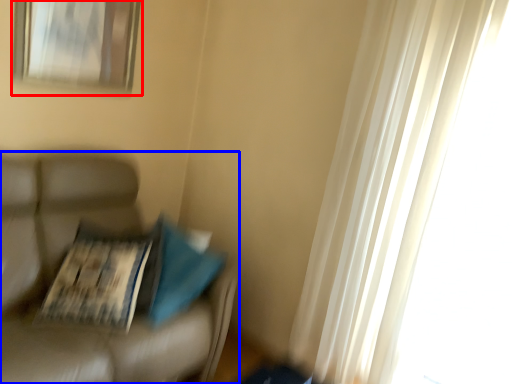
Question: Which object is further to the camera taking this photo, picture frame (highlighted by a red box) or furniture (highlighted by a blue box)?

Choices:
 (A) picture frame
 (B) furniture

Answer: (A)